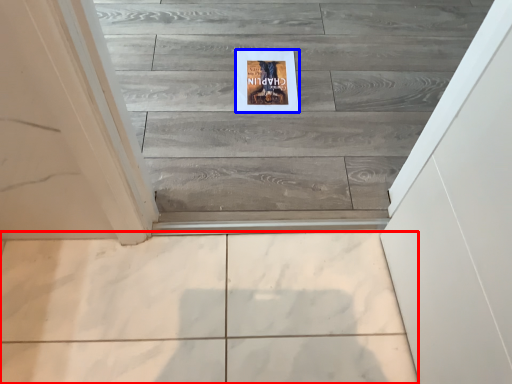
Question: Which of the following is the closest to the observer, ceramic tile (highlighted by a red box) or postcard (highlighted by a blue box)?

Choices:
 (A) ceramic tile
 (B) postcard

Answer: (A)